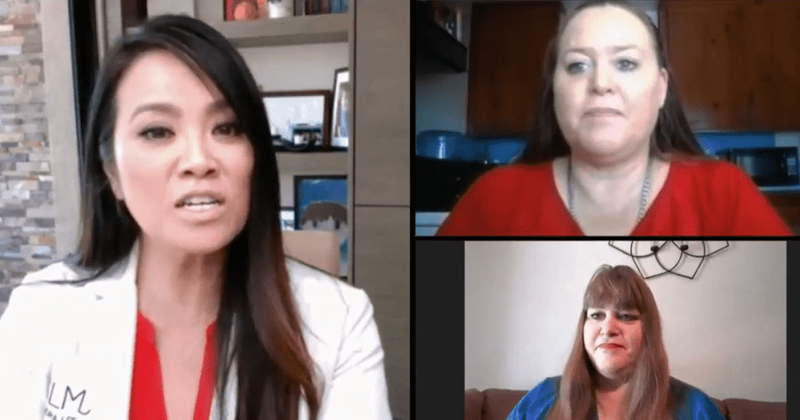
The width and height of the screenshot is (800, 420). I want to click on brick wall, so click(x=21, y=187).